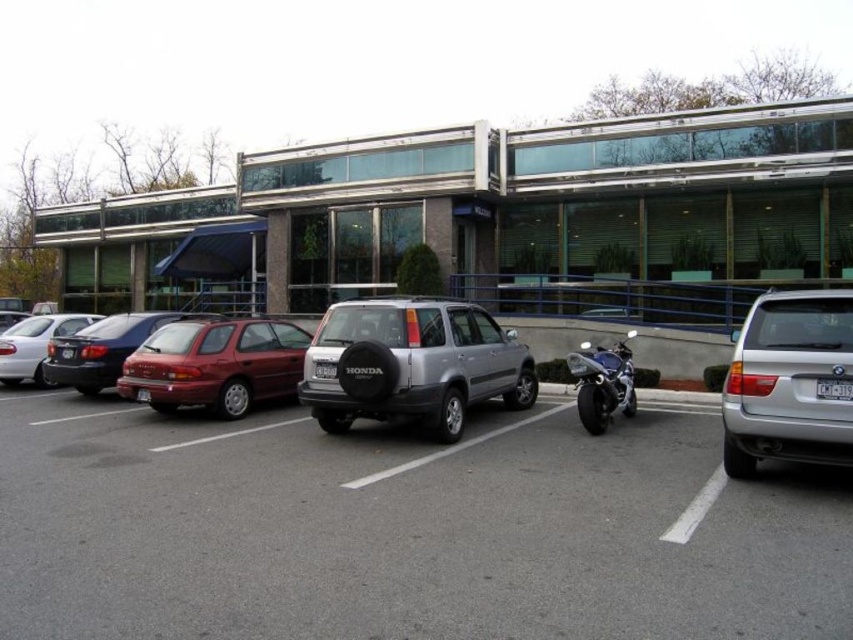
Question: Can you confirm if matte red hatchback at center-left is smaller than white plastic license plate at center?

Choices:
 (A) no
 (B) yes

Answer: (A)

Question: Considering the real-world distances, which object is closest to the shiny metallic motorcycle at center-right?

Choices:
 (A) silver metallic suv at center
 (B) black plastic license plate at center

Answer: (A)

Question: Which of the following is the farthest from the observer?

Choices:
 (A) matte silver sedan at left
 (B) silver metallic suv at right
 (C) black plastic license plate at center
 (D) silver metallic car at center

Answer: (A)

Question: Which point is closer to the camera taking this photo?

Choices:
 (A) (752, 531)
 (B) (782, 416)
 (C) (817, 381)

Answer: (A)

Question: In this image, where is silver metallic suv at center located relative to shiny metallic motorcycle at center-right?

Choices:
 (A) right
 (B) left

Answer: (B)

Question: Can you confirm if silver metallic suv at right is positioned to the left of matte black sedan at left?

Choices:
 (A) yes
 (B) no

Answer: (B)